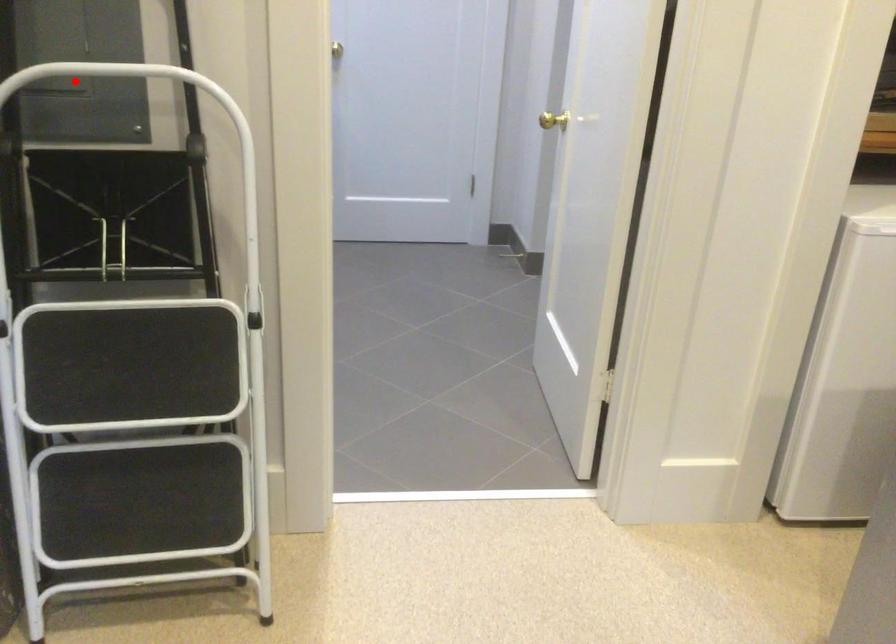
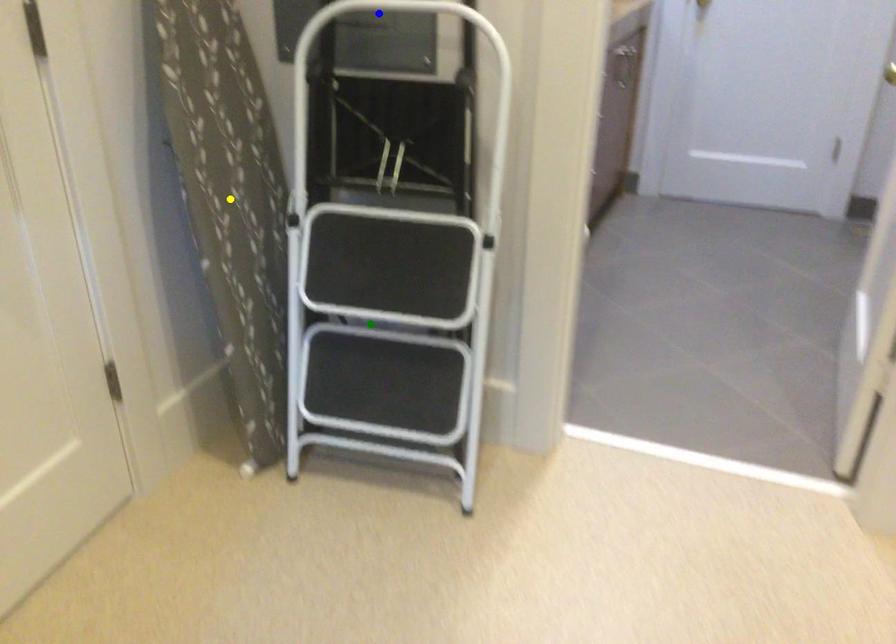
Question: I am providing you with two images of the same scene from different viewpoints. A red point is marked on the first image. You are given multiple points on the second image. Which spot in image 2 lines up with the point in image 1?

Choices:
 (A) green point
 (B) yellow point
 (C) blue point

Answer: (C)